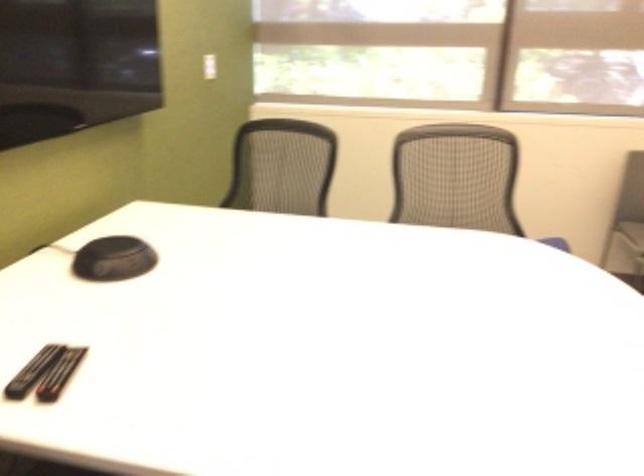
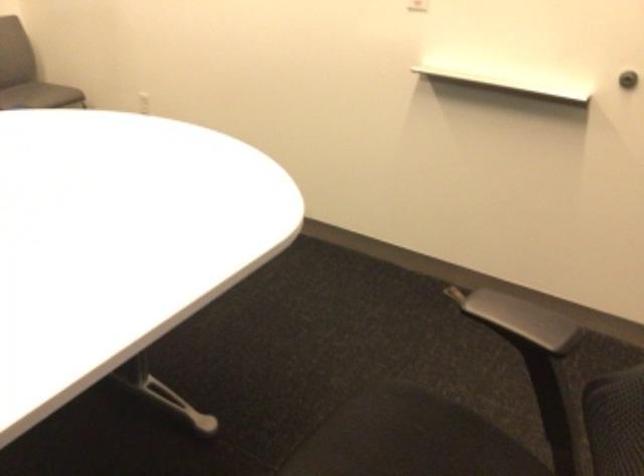
The images are taken continuously from a first-person perspective. In which direction is your viewpoint rotating?

The camera rotated toward right-down.